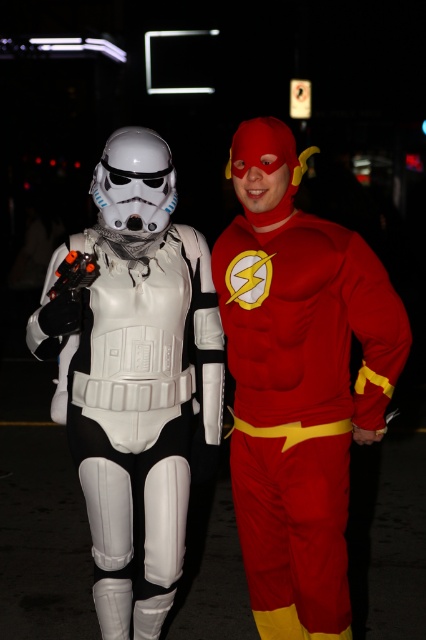
Question: Where is matte white armor at left located in relation to white matte stormtrooper armor at left in the image?

Choices:
 (A) right
 (B) left

Answer: (A)

Question: Among these points, which one is nearest to the camera?

Choices:
 (A) 218,346
 (B) 227,236

Answer: (B)

Question: Which object is the closest to the rubberized red suit at center?

Choices:
 (A) matte white armor at left
 (B) white matte stormtrooper armor at left

Answer: (A)

Question: Where is matte white armor at left located in relation to rubberized red suit at center in the image?

Choices:
 (A) left
 (B) right

Answer: (A)

Question: From the image, what is the correct spatial relationship of rubberized red suit at center in relation to white matte stormtrooper armor at left?

Choices:
 (A) below
 (B) above

Answer: (B)

Question: Among these points, which one is farthest from the camera?

Choices:
 (A) (155, 316)
 (B) (299, 512)

Answer: (A)